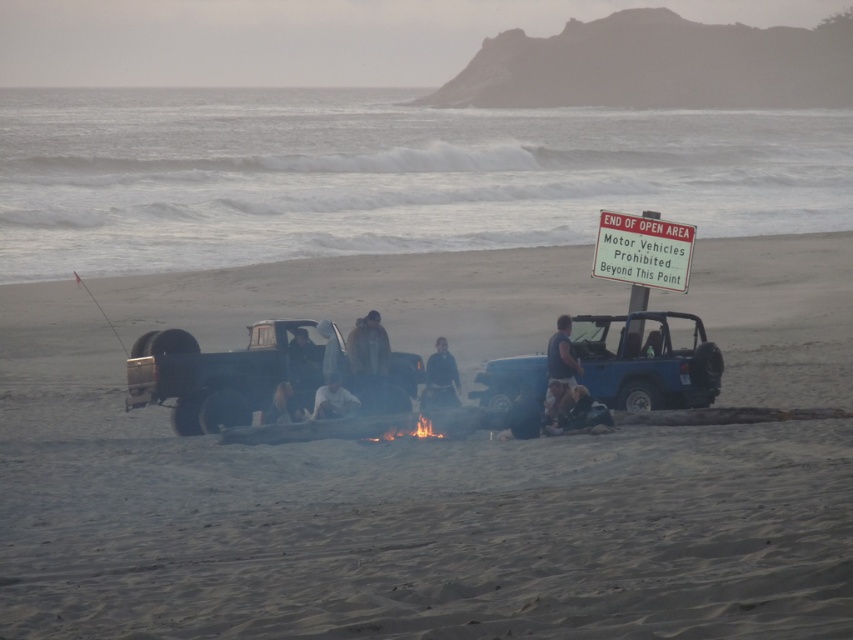
Question: Is dark blue jeans at center smaller than smooth blue jeans at center?

Choices:
 (A) yes
 (B) no

Answer: (B)

Question: Does matte blue jeep at center come behind dark blue jacket at center?

Choices:
 (A) yes
 (B) no

Answer: (B)

Question: Which of the following is the farthest from the observer?

Choices:
 (A) (355, 364)
 (B) (531, 387)
 (C) (259, 360)

Answer: (C)

Question: Based on their relative distances, which object is nearer to the dark gray fabric jacket at center?

Choices:
 (A) white fabric person at center
 (B) matte blue jeep at center
 (C) dark blue jeans at center
 (D) white cotton shirt at center

Answer: (D)

Question: Does matte blue jeep at center come in front of white cotton shirt at center?

Choices:
 (A) yes
 (B) no

Answer: (B)

Question: Which point is farther to the camera?

Choices:
 (A) (436, 358)
 (B) (520, 436)

Answer: (A)